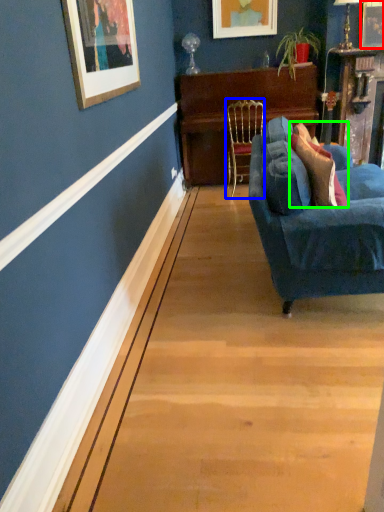
Question: Which object is positioned closest to picture frame (highlighted by a red box)? Select from chair (highlighted by a blue box) and pillow (highlighted by a green box).

Choices:
 (A) chair
 (B) pillow

Answer: (A)